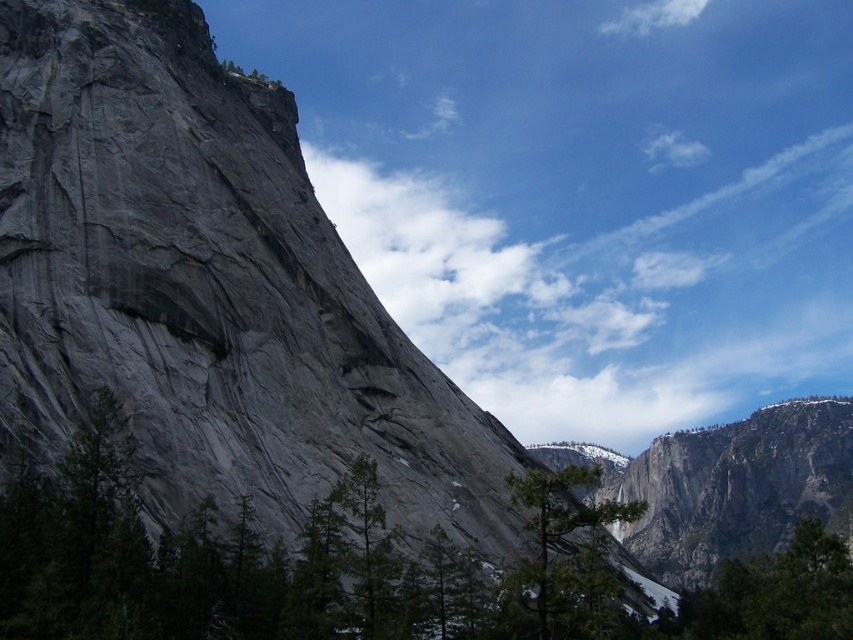
You are standing at the center of the image and want to locate the green matte tree at center. What are the coordinates where you should look?

The green matte tree at center is located at coordinates point (x=567, y=554).

You are standing at the center of the image and want to reach the green matte tree at lower right. Which direction should you move in to get there?

The green matte tree at lower right is located at point (775, 593), so you should move towards the lower right direction to reach it.